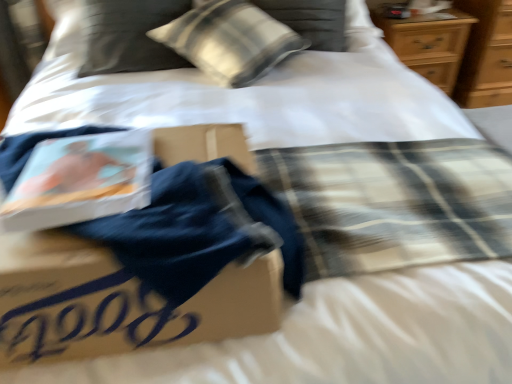
Question: Is white textured pillow at upper center in front of or behind wooden dresser at upper right in the image?

Choices:
 (A) front
 (B) behind

Answer: (A)

Question: From the image's perspective, is white textured pillow at upper center positioned above or below wooden dresser at upper right?

Choices:
 (A) above
 (B) below

Answer: (B)

Question: In terms of width, does white textured pillow at upper center look wider or thinner when compared to wooden dresser at upper right?

Choices:
 (A) wide
 (B) thin

Answer: (A)

Question: From the image's perspective, relative to white textured pillow at upper center, is wooden dresser at upper right above or below?

Choices:
 (A) below
 (B) above

Answer: (B)

Question: From a real-world perspective, is wooden dresser at upper right positioned above or below white textured pillow at upper center?

Choices:
 (A) above
 (B) below

Answer: (B)

Question: Considering the positions of wooden dresser at upper right and white textured pillow at upper center in the image, is wooden dresser at upper right bigger or smaller than white textured pillow at upper center?

Choices:
 (A) big
 (B) small

Answer: (A)

Question: In terms of width, does wooden dresser at upper right look wider or thinner when compared to white textured pillow at upper center?

Choices:
 (A) wide
 (B) thin

Answer: (B)